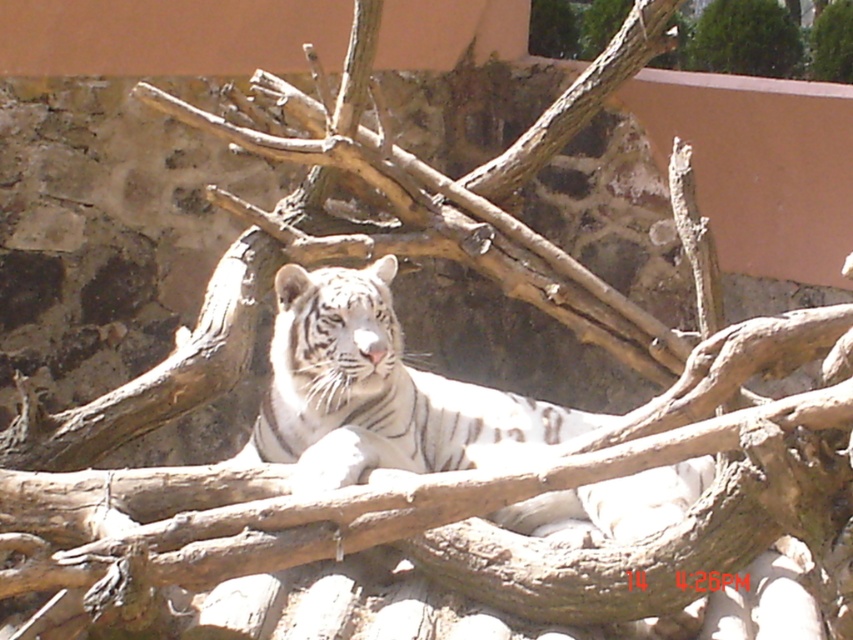
You are a zookeeper observing the white striped tiger at center and the green leafy tree at upper right in the enclosure. Which object is taller?

The white striped tiger at center is taller than the green leafy tree at upper right.

You are standing in a zoo enclosure and see the white striped tiger at center. If you want to observe the tiger from a closer distance without entering the restricted area, which direction should you move? Please provide a step by step explanation.

The white striped tiger at center is 18.62 feet away from you. To get closer without entering restricted areas, move forward towards the tiger while staying within designated visitor zones. Check signage or ask staff for safe viewing distances.

You are a zookeeper standing at the entrance of the enclosure. You need to place a new feeding tray for the white striped tiger at center. According to the tiger

The white striped tiger at center is located at point (378, 392). Therefore, the feeding tray should be placed near the tiger